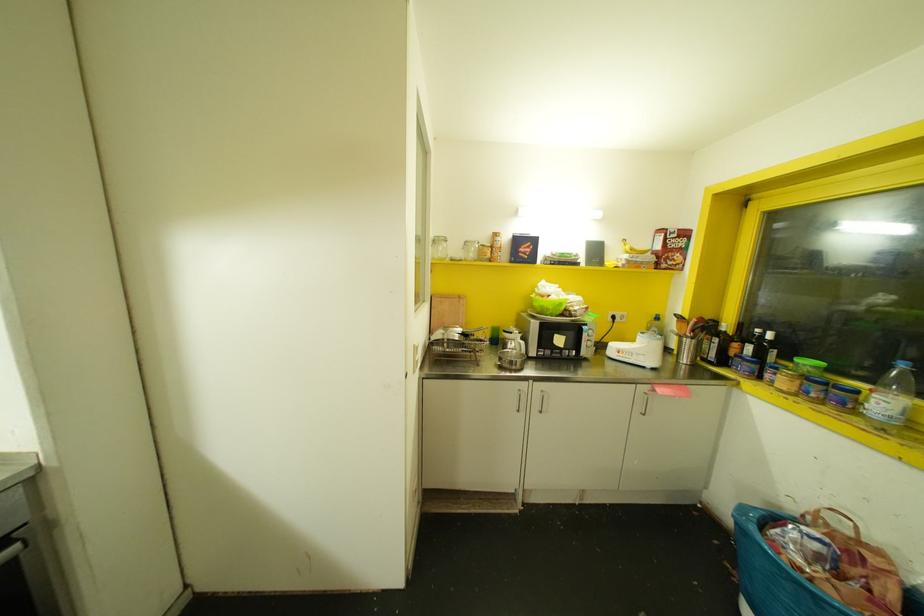
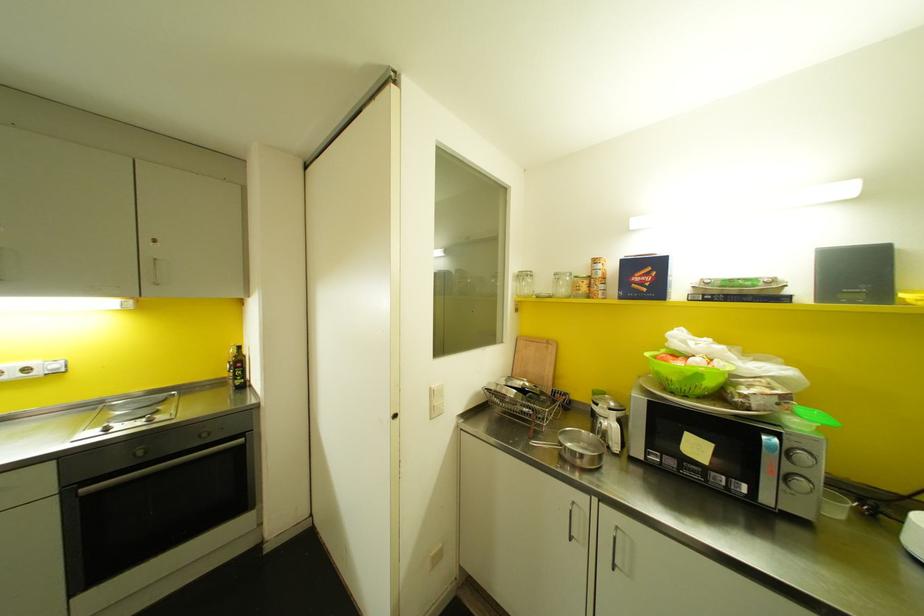
Where in the second image is the point corresponding to (489,260) from the first image?

(588, 294)